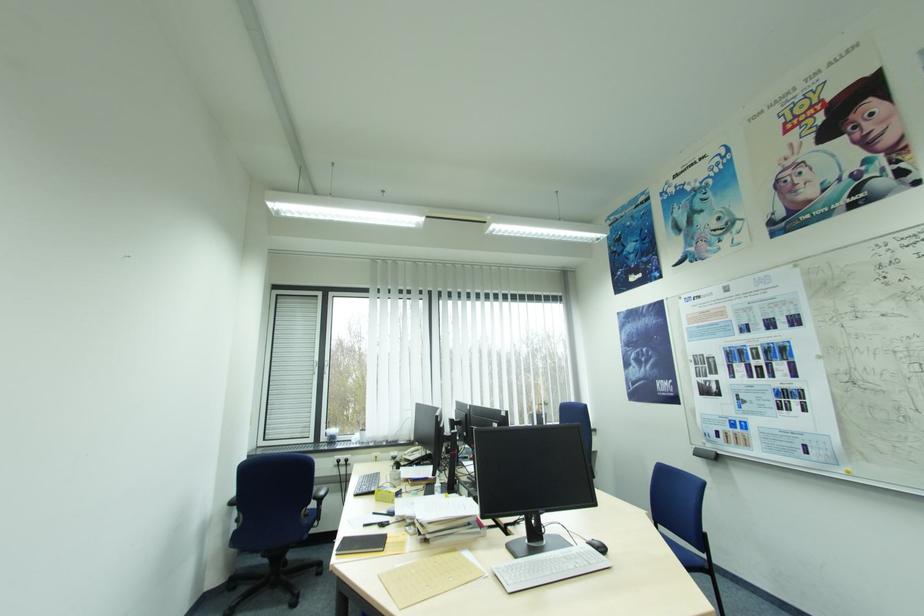
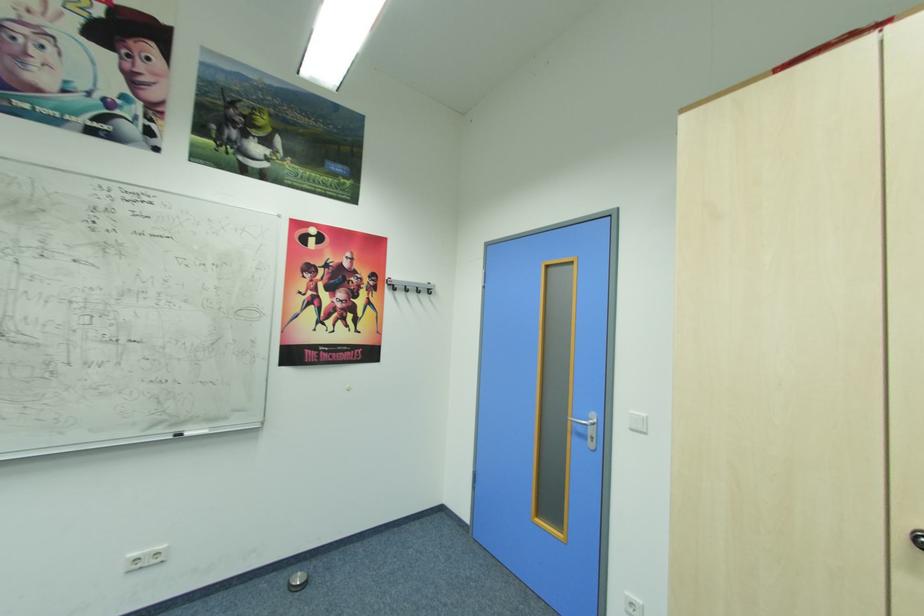
Question: How did the camera likely rotate?

Choices:
 (A) Left
 (B) Right
 (C) Up
 (D) Down

Answer: (B)